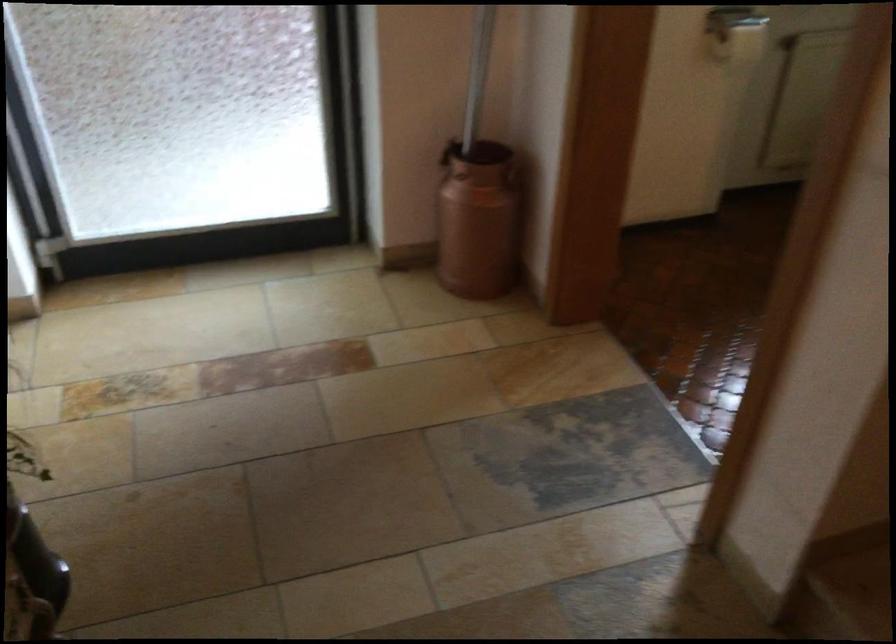
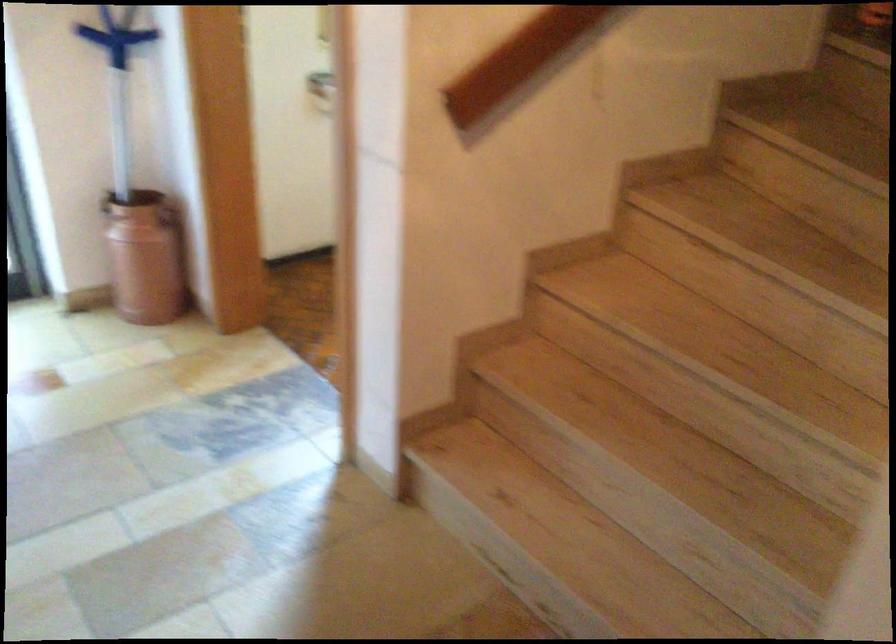
Find the pixel in the second image that matches [511,176] in the first image.

(168, 216)